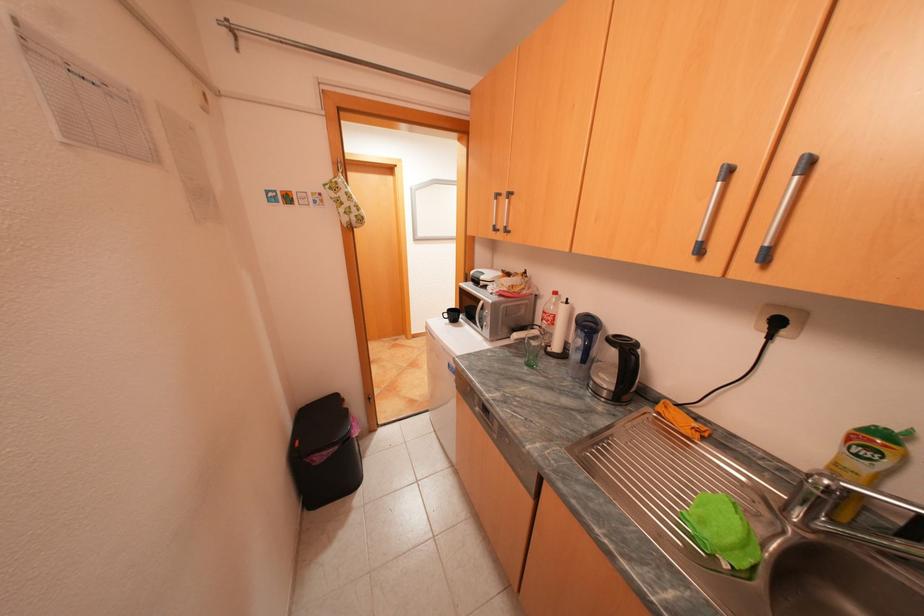
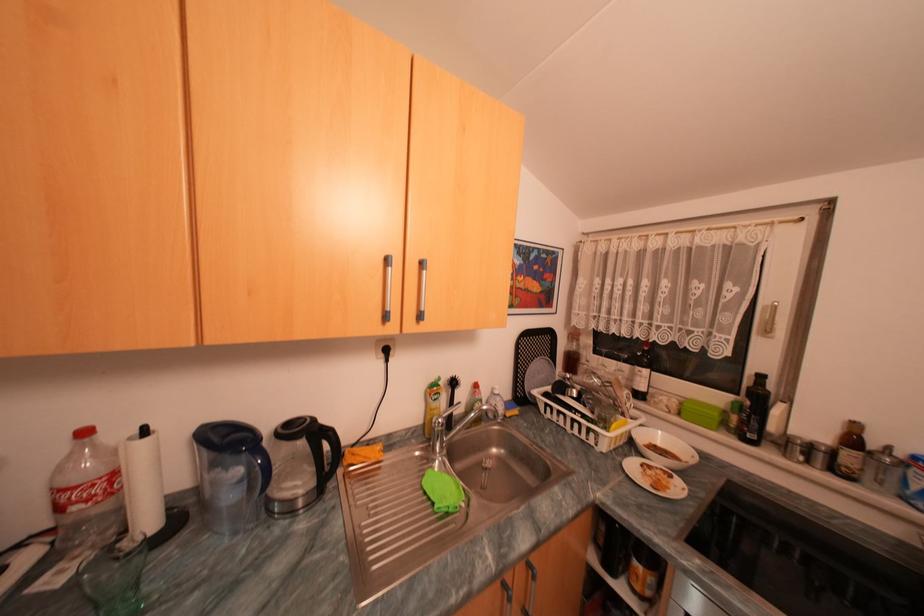
Locate, in the second image, the point that corresponds to (x=858, y=439) in the first image.

(440, 394)